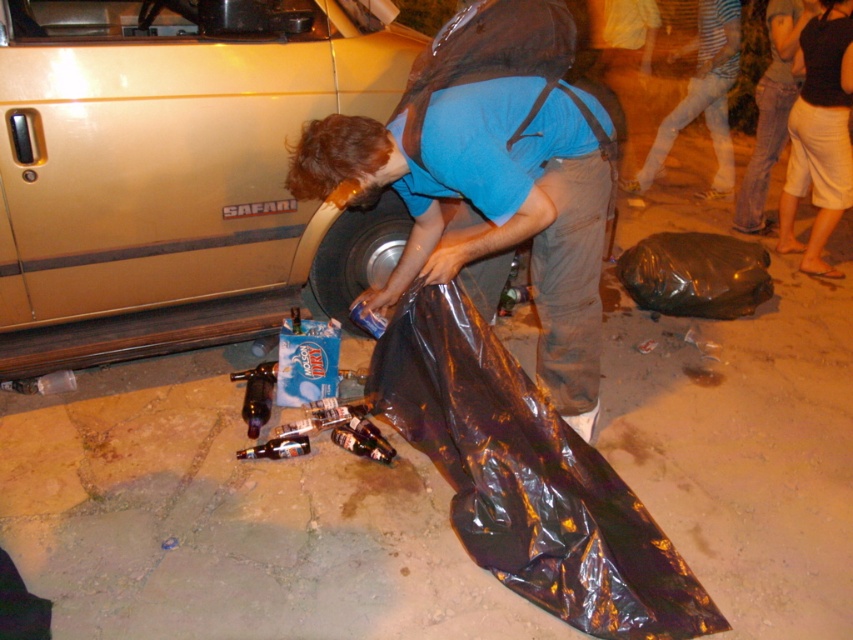
Between white cotton shorts at lower right and striped cotton shirt at lower right, which one appears on the right side from the viewer's perspective?

Positioned to the right is white cotton shorts at lower right.

Can you confirm if white cotton shorts at lower right is thinner than striped cotton shirt at lower right?

Yes, white cotton shorts at lower right is thinner than striped cotton shirt at lower right.

This screenshot has height=640, width=853. In order to click on white cotton shorts at lower right in this screenshot , I will do [819, 134].

I want to click on white cotton shorts at lower right, so click(x=819, y=134).

Who is taller, black plastic bag at lower right or metallic silver tire at lower center?

metallic silver tire at lower center is taller.

Which is below, black plastic bag at lower right or metallic silver tire at lower center?

metallic silver tire at lower center

Does point (698, 244) come in front of point (357, 240)?

That is False.

The height and width of the screenshot is (640, 853). What are the coordinates of `black plastic bag at lower right` in the screenshot? It's located at (695, 275).

Measure the distance between point (537, 144) and camera.

2.17 meters

Does shiny plastic bag at center have a greater width compared to metallic silver tire at lower center?

Yes.

Locate an element on the screen. This screenshot has width=853, height=640. shiny plastic bag at center is located at coordinates (489, 205).